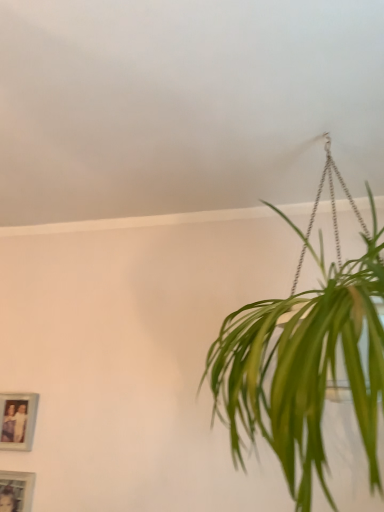
Question: Is wooden photo frame at lower left, the 1th picture frame ordered from the bottom, taller or shorter than matte blue picture frame at lower left, which ranks as the 1th picture frame in top-to-bottom order?

Choices:
 (A) tall
 (B) short

Answer: (A)

Question: In the image, is wooden photo frame at lower left, the 1th picture frame ordered from the bottom, positioned in front of or behind matte blue picture frame at lower left, which is the 2th picture frame from bottom to top?

Choices:
 (A) behind
 (B) front

Answer: (B)

Question: Considering the positions of wooden photo frame at lower left, the 1th picture frame ordered from the bottom, and matte blue picture frame at lower left, which is the 2th picture frame from bottom to top, in the image, is wooden photo frame at lower left, the 1th picture frame ordered from the bottom, wider or thinner than matte blue picture frame at lower left, which is the 2th picture frame from bottom to top,?

Choices:
 (A) wide
 (B) thin

Answer: (B)

Question: From the image's perspective, relative to wooden photo frame at lower left, the 1th picture frame ordered from the bottom, is matte blue picture frame at lower left, which is the 2th picture frame from bottom to top, above or below?

Choices:
 (A) above
 (B) below

Answer: (A)

Question: Would you say matte blue picture frame at lower left, which ranks as the 1th picture frame in top-to-bottom order, is to the left or to the right of wooden photo frame at lower left, which is the second picture frame in top-to-bottom order, in the picture?

Choices:
 (A) right
 (B) left

Answer: (B)

Question: Is matte blue picture frame at lower left, which ranks as the 1th picture frame in top-to-bottom order, situated inside wooden photo frame at lower left, the 1th picture frame ordered from the bottom, or outside?

Choices:
 (A) inside
 (B) outside

Answer: (B)

Question: Considering their positions, is matte blue picture frame at lower left, which ranks as the 1th picture frame in top-to-bottom order, located in front of or behind wooden photo frame at lower left, which is the second picture frame in top-to-bottom order?

Choices:
 (A) behind
 (B) front

Answer: (A)